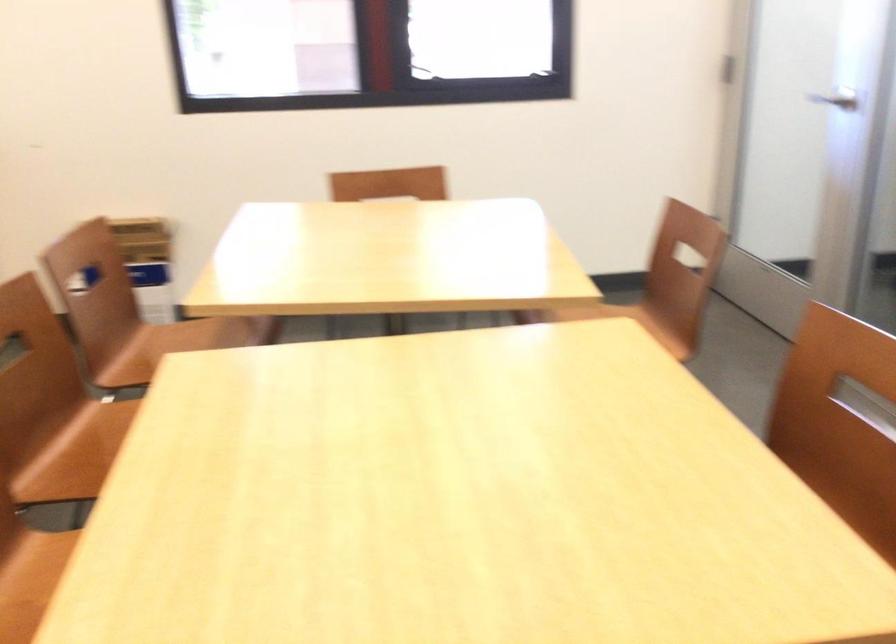
Question: How did the camera likely rotate?

Choices:
 (A) Left
 (B) Right
 (C) Up
 (D) Down

Answer: (B)